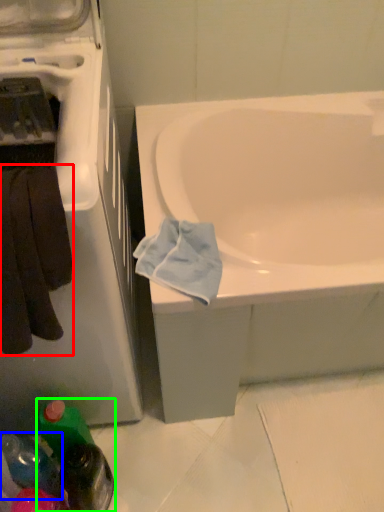
Question: Estimate the real-world distances between objects in this image. Which object is farther from towel/napkin (highlighted by a red box), bottle (highlighted by a blue box) or bottle (highlighted by a green box)?

Choices:
 (A) bottle
 (B) bottle

Answer: (A)